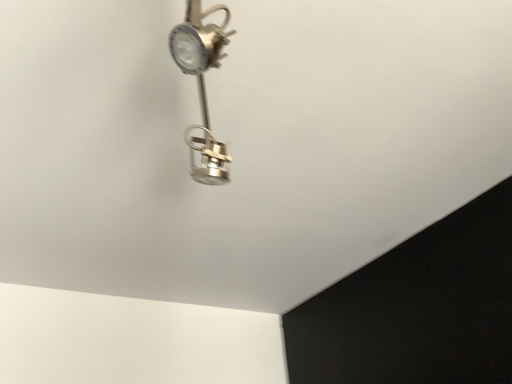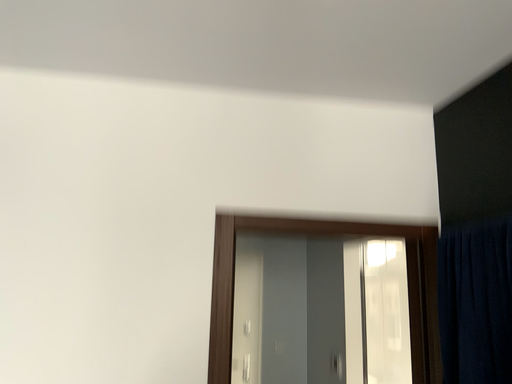
Question: How did the camera likely rotate when shooting the video?

Choices:
 (A) rotated downward
 (B) rotated upward

Answer: (A)